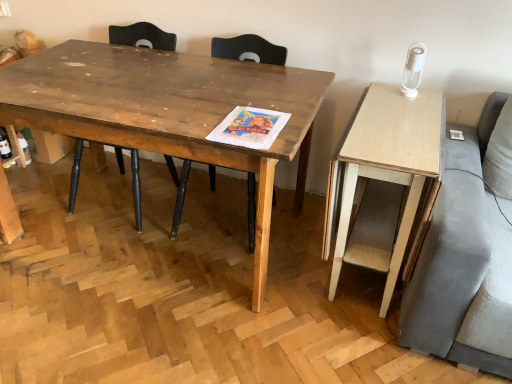
What do you see at coordinates (168, 110) in the screenshot?
I see `wooden table at center` at bounding box center [168, 110].

Describe the element at coordinates (248, 49) in the screenshot. I see `wooden chair at center, arranged as the 2th chair when viewed from the left` at that location.

I want to click on wooden chair at center, marked as the 1th chair in a left-to-right arrangement, so click(142, 36).

Between wooden chair at center, arranged as the 2th chair when viewed from the left, and wooden chair at center, marked as the 1th chair in a left-to-right arrangement, which one has more height?

With more height is wooden chair at center, marked as the 1th chair in a left-to-right arrangement.

From the image's perspective, which is above, wooden chair at center, marked as the first chair in a right-to-left arrangement, or wooden chair at center, which appears as the second chair when viewed from the right?

wooden chair at center, which appears as the second chair when viewed from the right, appears higher in the image.

Considering the sizes of objects wooden chair at center, arranged as the 2th chair when viewed from the left, and wooden chair at center, marked as the 1th chair in a left-to-right arrangement, in the image provided, who is wider, wooden chair at center, arranged as the 2th chair when viewed from the left, or wooden chair at center, marked as the 1th chair in a left-to-right arrangement,?

With larger width is wooden chair at center, marked as the 1th chair in a left-to-right arrangement.

From the image's perspective, does light wood desk at right appear higher than wooden chair at center, marked as the first chair in a right-to-left arrangement?

No, from the image's perspective, light wood desk at right is not on top of wooden chair at center, marked as the first chair in a right-to-left arrangement.

Can you confirm if light wood desk at right is smaller than wooden chair at center, marked as the first chair in a right-to-left arrangement?

Yes, light wood desk at right is smaller than wooden chair at center, marked as the first chair in a right-to-left arrangement.

Looking at this image, is light wood desk at right not near wooden chair at center, arranged as the 2th chair when viewed from the left?

Actually, light wood desk at right and wooden chair at center, arranged as the 2th chair when viewed from the left, are a little close together.

Which point is more forward, [414,118] or [280,51]?

The point [414,118] is closer to the camera.

Measure the distance from wooden chair at center, which appears as the second chair when viewed from the right, to light wood desk at right.

A distance of 39.03 inches exists between wooden chair at center, which appears as the second chair when viewed from the right, and light wood desk at right.

Would you consider wooden chair at center, marked as the 1th chair in a left-to-right arrangement, to be distant from light wood desk at right?

No, wooden chair at center, marked as the 1th chair in a left-to-right arrangement, is not far away from light wood desk at right.

In terms of width, does wooden chair at center, marked as the 1th chair in a left-to-right arrangement, look wider or thinner when compared to light wood desk at right?

Considering their sizes, wooden chair at center, marked as the 1th chair in a left-to-right arrangement, looks slimmer than light wood desk at right.

Is wooden chair at center, marked as the 1th chair in a left-to-right arrangement, facing towards light wood desk at right?

No, wooden chair at center, marked as the 1th chair in a left-to-right arrangement, is not oriented towards light wood desk at right.

Which is more to the left, wooden table at center or wooden chair at center, arranged as the 2th chair when viewed from the left?

Positioned to the left is wooden table at center.

Does point (102, 53) lie behind point (243, 45)?

Yes, point (102, 53) is farther from viewer.

Can you confirm if wooden table at center is shorter than wooden chair at center, marked as the first chair in a right-to-left arrangement?

Yes.

Is wooden chair at center, marked as the first chair in a right-to-left arrangement, inside the boundaries of light wood desk at right, or outside?

The correct answer is: outside.

From a real-world perspective, is wooden chair at center, marked as the first chair in a right-to-left arrangement, physically above light wood desk at right?

Yes, from a real-world perspective, wooden chair at center, marked as the first chair in a right-to-left arrangement, is on top of light wood desk at right.

Which is in front, point (243, 58) or point (437, 157)?

The point (437, 157) is closer to the camera.

In the scene shown: In terms of width, does wooden chair at center, marked as the first chair in a right-to-left arrangement, look wider or thinner when compared to light wood desk at right?

wooden chair at center, marked as the first chair in a right-to-left arrangement, is thinner than light wood desk at right.

From the image's perspective, which is below, wooden table at center or wooden chair at center, which appears as the second chair when viewed from the right?

From the image's view, wooden table at center is below.

Locate an element on the screen. Image resolution: width=512 pixels, height=384 pixels. coffee table in front of the wooden chair at center, marked as the 1th chair in a left-to-right arrangement is located at coordinates (168, 110).

Considering the relative sizes of wooden table at center and wooden chair at center, marked as the 1th chair in a left-to-right arrangement, in the image provided, is wooden table at center taller than wooden chair at center, marked as the 1th chair in a left-to-right arrangement,?

Incorrect, the height of wooden table at center is not larger of that of wooden chair at center, marked as the 1th chair in a left-to-right arrangement.

Based on the photo, between wooden table at center and wooden chair at center, marked as the 1th chair in a left-to-right arrangement, which one has larger size?

Bigger between the two is wooden table at center.

In the scene shown: From the image's perspective, would you say wooden chair at center, which appears as the second chair when viewed from the right, is shown under wooden table at center?

Incorrect, from the image's perspective, wooden chair at center, which appears as the second chair when viewed from the right, is higher than wooden table at center.

Is point (170, 172) in front of point (258, 183)?

No, it is behind (258, 183).

Considering the relative sizes of wooden chair at center, marked as the 1th chair in a left-to-right arrangement, and wooden table at center in the image provided, is wooden chair at center, marked as the 1th chair in a left-to-right arrangement, bigger than wooden table at center?

Incorrect, wooden chair at center, marked as the 1th chair in a left-to-right arrangement, is not larger than wooden table at center.

Locate an element on the screen. chair lying behind the wooden chair at center, arranged as the 2th chair when viewed from the left is located at coordinates (142, 36).

Find the location of `desk below the wooden chair at center, marked as the first chair in a right-to-left arrangement (from the image's perspective)`. desk below the wooden chair at center, marked as the first chair in a right-to-left arrangement (from the image's perspective) is located at coordinates (383, 179).

Considering their positions, is wooden chair at center, marked as the first chair in a right-to-left arrangement, positioned closer to wooden table at center than wooden chair at center, marked as the 1th chair in a left-to-right arrangement?

Based on the image, wooden chair at center, marked as the first chair in a right-to-left arrangement, appears to be nearer to wooden table at center.

Estimate the real-world distances between objects in this image. Which object is closer to light wood desk at right, wooden chair at center, which appears as the second chair when viewed from the right, or wooden chair at center, marked as the first chair in a right-to-left arrangement?

wooden chair at center, marked as the first chair in a right-to-left arrangement.

From the image, which object appears to be farther from wooden table at center, wooden chair at center, arranged as the 2th chair when viewed from the left, or light wood desk at right?

light wood desk at right.

Looking at the image, which one is located further to wooden chair at center, marked as the first chair in a right-to-left arrangement, wooden table at center or light wood desk at right?

The object further to wooden chair at center, marked as the first chair in a right-to-left arrangement, is light wood desk at right.

Looking at the image, which one is located closer to wooden chair at center, marked as the first chair in a right-to-left arrangement, light wood desk at right or wooden chair at center, which appears as the second chair when viewed from the right?

wooden chair at center, which appears as the second chair when viewed from the right, is positioned closer to the anchor wooden chair at center, marked as the first chair in a right-to-left arrangement.

Based on their spatial positions, is wooden chair at center, marked as the 1th chair in a left-to-right arrangement, or wooden table at center further from light wood desk at right?

The object further to light wood desk at right is wooden chair at center, marked as the 1th chair in a left-to-right arrangement.

Looking at the image, which one is located closer to light wood desk at right, wooden table at center or wooden chair at center, marked as the 1th chair in a left-to-right arrangement?

Among the two, wooden table at center is located nearer to light wood desk at right.

Considering their positions, is light wood desk at right positioned closer to wooden table at center than wooden chair at center, arranged as the 2th chair when viewed from the left?

Based on the image, wooden chair at center, arranged as the 2th chair when viewed from the left, appears to be nearer to wooden table at center.

You are a GUI agent. You are given a task and a screenshot of the screen. Output one action in this format:
    pyautogui.click(x=<x>, y=<y>)
    Task: Click on the chair located between wooden table at center and light wood desk at right in the left-right direction
    The image size is (512, 384).
    Given the screenshot: What is the action you would take?
    click(x=248, y=49)

This screenshot has height=384, width=512. Identify the location of chair between wooden chair at center, which appears as the second chair when viewed from the right, and light wood desk at right, in the horizontal direction. (248, 49).

Locate an element on the screen. This screenshot has height=384, width=512. coffee table between wooden chair at center, which appears as the second chair when viewed from the right, and wooden chair at center, marked as the first chair in a right-to-left arrangement, in the horizontal direction is located at coordinates (168, 110).

At what (x,y) coordinates should I click in order to perform the action: click on coffee table between wooden chair at center, which appears as the second chair when viewed from the right, and light wood desk at right from left to right. Please return your answer as a coordinate pair (x, y). The height and width of the screenshot is (384, 512). Looking at the image, I should click on (168, 110).